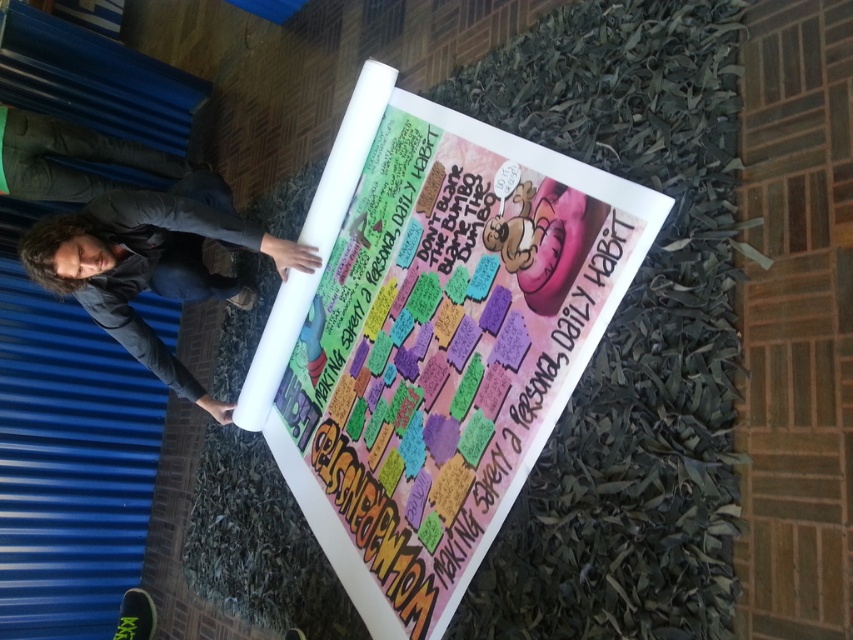
You are a photographer trying to capture a photo of the multicolored paperboard at center and the dark gray jacket at lower left in the same frame. Given that your camera has a maximum focus range of 20 inches, will you be able to capture both objects clearly in the photo?

The distance between the multicolored paperboard at center and the dark gray jacket at lower left is 22.86 inches, which exceeds the camera maximum focus range of 20 inches. Therefore, you cannot capture both objects clearly in the same photo.

You are taking a photo of the poster and want to ensure both the point at point (286, 294) and the point at point (173, 189) are in focus. Which point is closer to the camera and should be prioritized for focus?

Point (286, 294) is closer to the camera than point (173, 189), so it should be prioritized for focus.